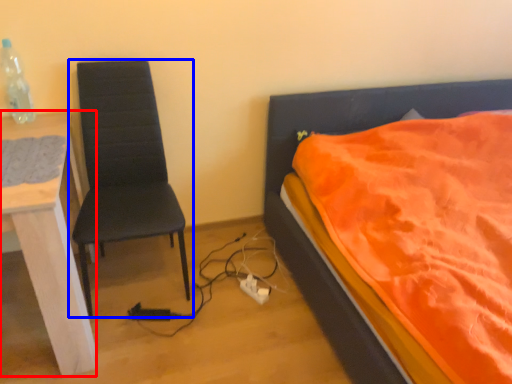
Question: Which object is further to the camera taking this photo, desk (highlighted by a red box) or chair (highlighted by a blue box)?

Choices:
 (A) desk
 (B) chair

Answer: (B)